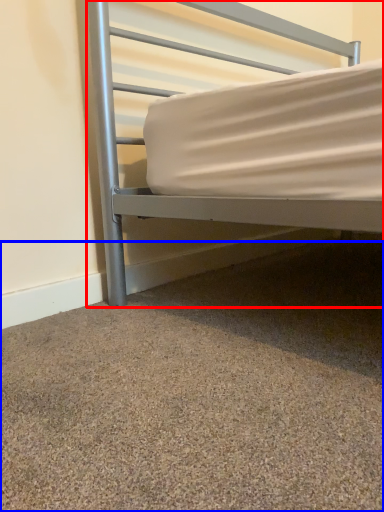
Question: Which object is closer to the camera taking this photo, bed (highlighted by a red box) or granite (highlighted by a blue box)?

Choices:
 (A) bed
 (B) granite

Answer: (B)